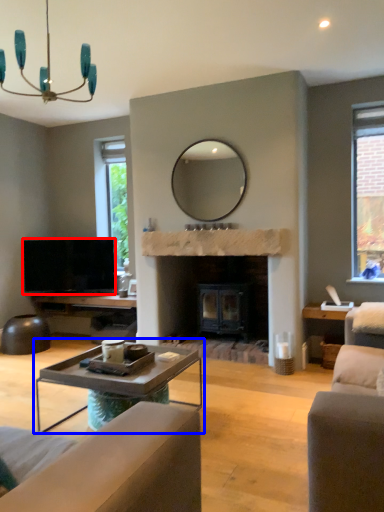
Question: Which point is further to the camera, television (highlighted by a red box) or coffee table (highlighted by a blue box)?

Choices:
 (A) television
 (B) coffee table

Answer: (A)